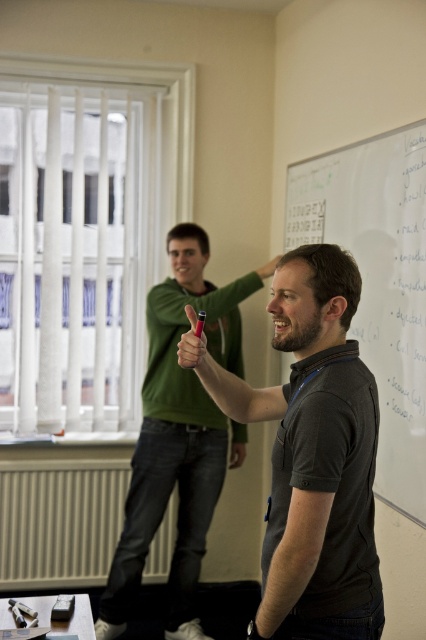
From the picture: You are standing in the classroom and want to locate the dark gray shirt at center. According to the coordinates provided, which object corresponds to the point marked at (313, 454)?

The point at (313, 454) corresponds to the dark gray shirt at center.